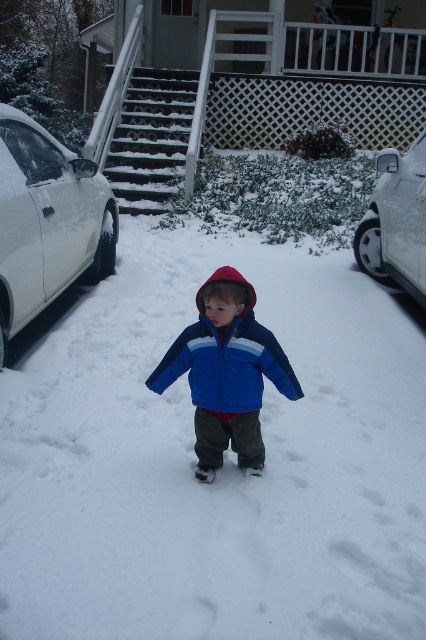
Question: Which is farther from the white glossy car at left?

Choices:
 (A) blue fleece jacket at center
 (B) white glossy car at right

Answer: (B)

Question: Which point is farther from the camera taking this photo?

Choices:
 (A) (192, 369)
 (B) (408, 216)

Answer: (B)

Question: Which point is farther to the camera?

Choices:
 (A) blue fleece jacket at center
 (B) white glossy car at left
 (C) white glossy car at right

Answer: (C)

Question: Is blue fleece jacket at center wider than white glossy car at right?

Choices:
 (A) yes
 (B) no

Answer: (A)

Question: Is blue fleece jacket at center to the right of white glossy car at right from the viewer's perspective?

Choices:
 (A) yes
 (B) no

Answer: (B)

Question: Is blue fleece jacket at center positioned in front of white glossy car at right?

Choices:
 (A) yes
 (B) no

Answer: (A)